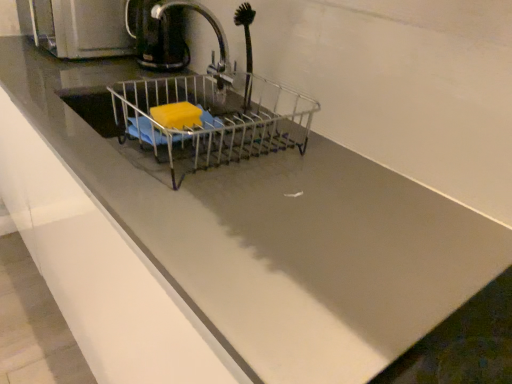
Where is `spots to the right of metallic wire basket at center`? This screenshot has height=384, width=512. spots to the right of metallic wire basket at center is located at coordinates (353, 189).